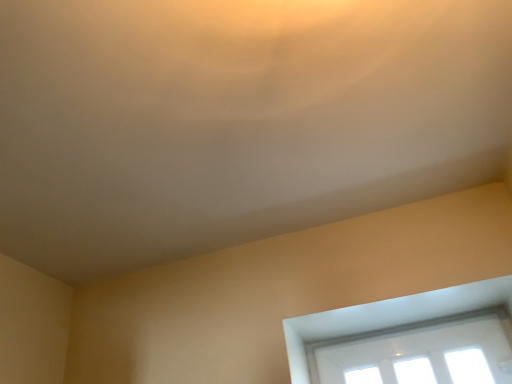
What is the approximate height of white glossy window at lower right?

2.58 centimeters.

What do you see at coordinates (384, 316) in the screenshot? I see `white glossy window at lower right` at bounding box center [384, 316].

Identify the location of white glossy window at lower right. The height and width of the screenshot is (384, 512). (384, 316).

Where is `white glossy window at lower right`? white glossy window at lower right is located at coordinates (384, 316).